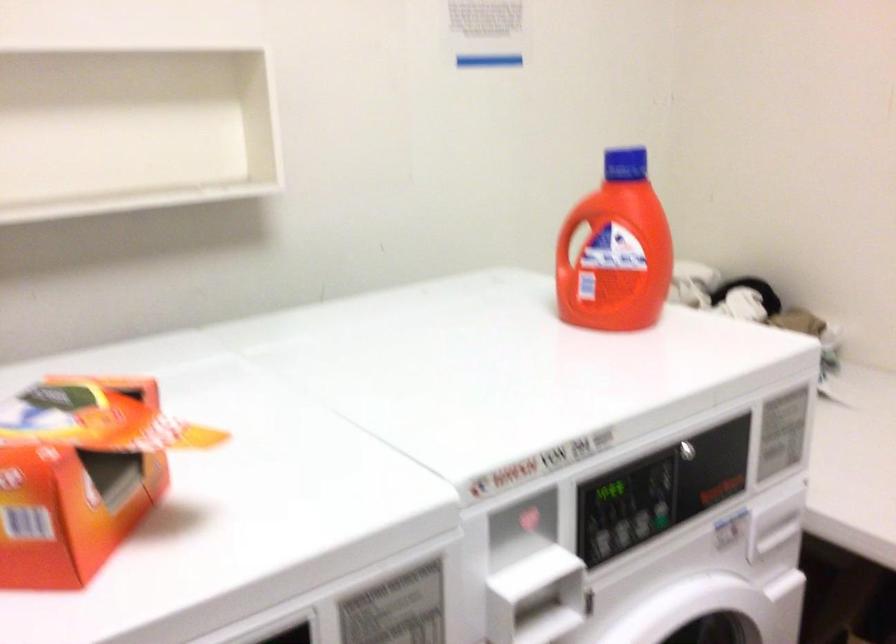
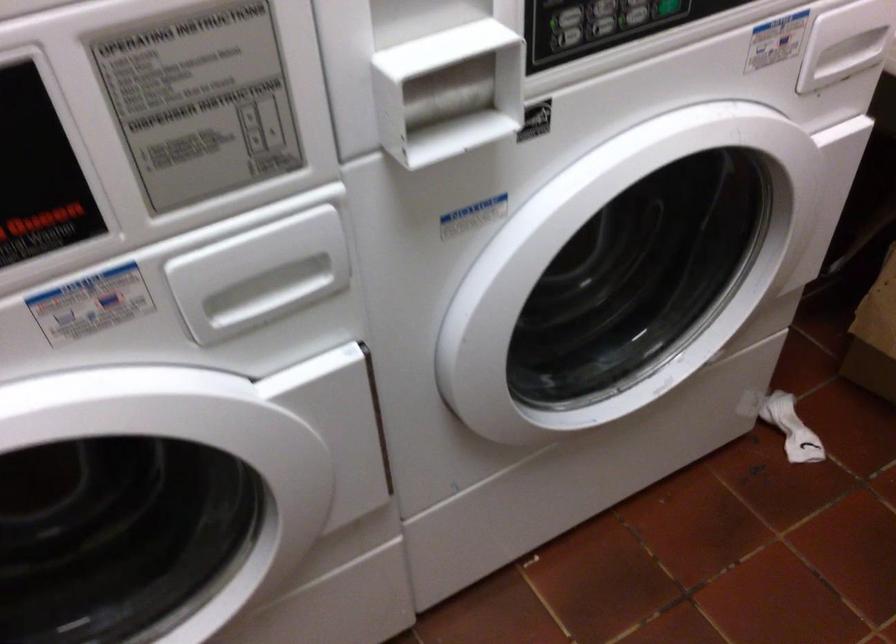
The images are taken continuously from a first-person perspective. In which direction are you moving?

The cameraman moved toward right, forward.